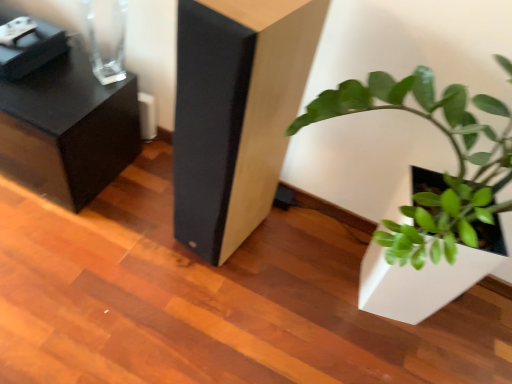
Question: Which direction should I rotate to face matte black speaker at center, marked as the 1th furniture in a right-to-left arrangement, — up or down?

Choices:
 (A) down
 (B) up

Answer: (B)

Question: Does matte black speaker at center, placed as the second furniture when sorted from left to right, have a smaller size compared to black textured side table at upper left, the second furniture from the right?

Choices:
 (A) no
 (B) yes

Answer: (B)

Question: From a real-world perspective, is matte black speaker at center, placed as the second furniture when sorted from left to right, under black textured side table at upper left, which appears as the first furniture when viewed from the left?

Choices:
 (A) yes
 (B) no

Answer: (B)

Question: Considering the relative positions of matte black speaker at center, marked as the 1th furniture in a right-to-left arrangement, and black textured side table at upper left, which appears as the first furniture when viewed from the left, in the image provided, is matte black speaker at center, marked as the 1th furniture in a right-to-left arrangement, in front of black textured side table at upper left, which appears as the first furniture when viewed from the left,?

Choices:
 (A) no
 (B) yes

Answer: (B)

Question: Is matte black speaker at center, placed as the second furniture when sorted from left to right, thinner than black textured side table at upper left, the second furniture from the right?

Choices:
 (A) no
 (B) yes

Answer: (B)

Question: Is the surface of matte black speaker at center, marked as the 1th furniture in a right-to-left arrangement, in direct contact with black textured side table at upper left, which appears as the first furniture when viewed from the left?

Choices:
 (A) no
 (B) yes

Answer: (A)

Question: From the image's perspective, is matte black speaker at center, marked as the 1th furniture in a right-to-left arrangement, on top of black textured side table at upper left, the second furniture from the right?

Choices:
 (A) yes
 (B) no

Answer: (B)

Question: From a real-world perspective, does green matte plant at lower right sit lower than black textured side table at upper left, the second furniture from the right?

Choices:
 (A) no
 (B) yes

Answer: (A)

Question: Is green matte plant at lower right far away from black textured side table at upper left, which appears as the first furniture when viewed from the left?

Choices:
 (A) yes
 (B) no

Answer: (A)

Question: Is green matte plant at lower right positioned beyond the bounds of black textured side table at upper left, which appears as the first furniture when viewed from the left?

Choices:
 (A) no
 (B) yes

Answer: (B)

Question: Does green matte plant at lower right have a lesser width compared to black textured side table at upper left, the second furniture from the right?

Choices:
 (A) no
 (B) yes

Answer: (A)

Question: Is black textured side table at upper left, the second furniture from the right, inside green matte plant at lower right?

Choices:
 (A) yes
 (B) no

Answer: (B)

Question: From a real-world perspective, is green matte plant at lower right located higher than black textured side table at upper left, which appears as the first furniture when viewed from the left?

Choices:
 (A) yes
 (B) no

Answer: (A)

Question: From a real-world perspective, is black textured side table at upper left, the second furniture from the right, physically below green matte plant at lower right?

Choices:
 (A) yes
 (B) no

Answer: (A)